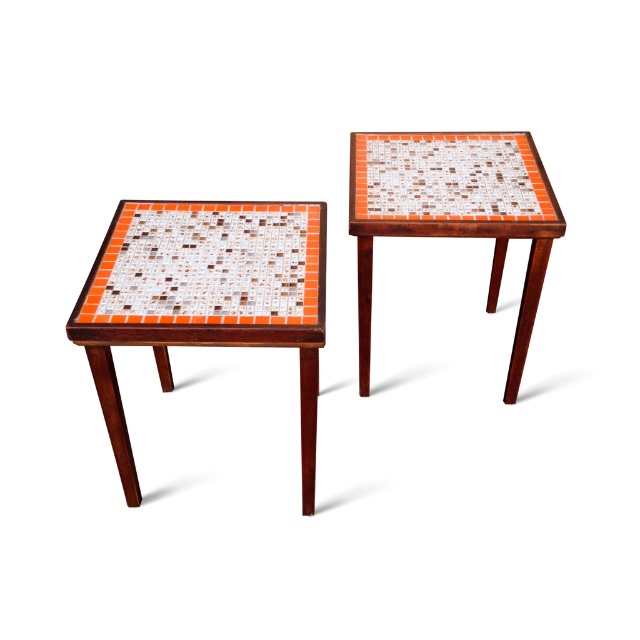
You are standing next to a camera and want to place a 1.2 meter wide decorative mat between the camera and the mosaic tile table at left. Will the mat fit perfectly without overlapping either the camera or the table?

The distance between the camera and the mosaic tile table at left is 1.35 meters. Since the mat is 1.2 meters wide, there will be 0.15 meters of space remaining between them. The mat will fit but will not take up the entire space between the camera and the table.

You are an interior designer analyzing the placement of the orange mosaic tile at left in the image. What are the coordinates of this tile?

The orange mosaic tile at left is located at coordinates (x=209, y=264).